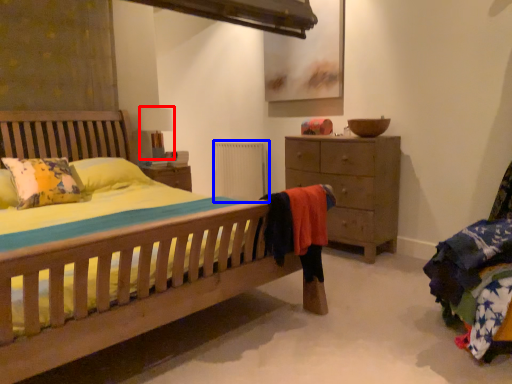
Question: Among these objects, which one is nearest to the camera, table lamp (highlighted by a red box) or radiator (highlighted by a blue box)?

Choices:
 (A) table lamp
 (B) radiator

Answer: (A)